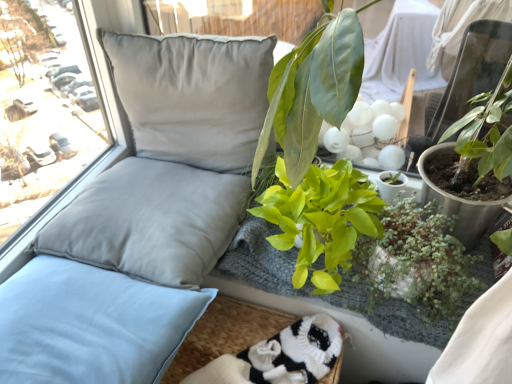
Describe the element at coordinates (90, 324) in the screenshot. I see `light blue fabric pillow at left, the third pillow in the top-to-bottom sequence` at that location.

This screenshot has width=512, height=384. What do you see at coordinates (193, 95) in the screenshot?
I see `satin gray pillow at upper left, which is the third pillow in bottom-to-top order` at bounding box center [193, 95].

I want to click on green leafy plant at center, which ranks as the second floral arrangement in top-to-bottom order, so click(366, 237).

What is the approximate height of green glossy plant at center, arranged as the second houseplant when viewed from the right?

The height of green glossy plant at center, arranged as the second houseplant when viewed from the right, is 25.40 centimeters.

Describe the element at coordinates (150, 221) in the screenshot. This screenshot has width=512, height=384. I see `satin gray pillow at left, which appears as the second pillow when viewed from the top` at that location.

What is the approximate width of white knitted socks at lower center?

The width of white knitted socks at lower center is 7.57 inches.

Where is `green matte plant at lower right, the first houseplant positioned from the right`? green matte plant at lower right, the first houseplant positioned from the right is located at coordinates (418, 260).

Is green glossy plant at center, which ranks as the 1th houseplant in left-to-right order, positioned behind green leafy plant at upper right, which is counted as the second floral arrangement, starting from the bottom?

Yes, green glossy plant at center, which ranks as the 1th houseplant in left-to-right order, is further from the camera.

From a real-world perspective, is green glossy plant at center, which ranks as the 1th houseplant in left-to-right order, positioned under green leafy plant at upper right, acting as the 1th floral arrangement starting from the top, based on gravity?

Yes, from a real-world perspective, green glossy plant at center, which ranks as the 1th houseplant in left-to-right order, is below green leafy plant at upper right, acting as the 1th floral arrangement starting from the top.

Is green glossy plant at center, which ranks as the 1th houseplant in left-to-right order, smaller than green leafy plant at upper right, acting as the 1th floral arrangement starting from the top?

Yes, green glossy plant at center, which ranks as the 1th houseplant in left-to-right order, is smaller than green leafy plant at upper right, acting as the 1th floral arrangement starting from the top.

Is green glossy plant at center, arranged as the second houseplant when viewed from the right, positioned far away from green leafy plant at upper right, which is counted as the second floral arrangement, starting from the bottom?

No.

Between green matte plant at lower right, the 2th houseplant in the left-to-right sequence, and green leafy plant at upper right, acting as the 1th floral arrangement starting from the top, which one appears on the right side from the viewer's perspective?

Positioned to the right is green matte plant at lower right, the 2th houseplant in the left-to-right sequence.

Locate an element on the screen. houseplant located on the right of green leafy plant at upper right, which is counted as the second floral arrangement, starting from the bottom is located at coordinates (418, 260).

From the image's perspective, which is below, green matte plant at lower right, the 2th houseplant in the left-to-right sequence, or green leafy plant at upper right, acting as the 1th floral arrangement starting from the top?

From the image's view, green matte plant at lower right, the 2th houseplant in the left-to-right sequence, is below.

Could you tell me if white knitted socks at lower center is facing light blue fabric pillow at left, placed as the first pillow when sorted from bottom to top?

No, white knitted socks at lower center does not turn towards light blue fabric pillow at left, placed as the first pillow when sorted from bottom to top.

Which object is closer to the camera taking this photo, white knitted socks at lower center or light blue fabric pillow at left, placed as the first pillow when sorted from bottom to top?

light blue fabric pillow at left, placed as the first pillow when sorted from bottom to top.

The height and width of the screenshot is (384, 512). In order to click on wide that appears behind the light blue fabric pillow at left, the third pillow in the top-to-bottom sequence in this screenshot , I will do `click(280, 356)`.

What's the angular difference between white knitted socks at lower center and light blue fabric pillow at left, the third pillow in the top-to-bottom sequence,'s facing directions?

The facing directions of white knitted socks at lower center and light blue fabric pillow at left, the third pillow in the top-to-bottom sequence, are 32.4 degrees apart.

In the scene shown: Are green leafy plant at upper right, acting as the 1th floral arrangement starting from the top, and green matte plant at lower right, the 2th houseplant in the left-to-right sequence, far apart?

No, green leafy plant at upper right, acting as the 1th floral arrangement starting from the top, is not far from green matte plant at lower right, the 2th houseplant in the left-to-right sequence.

From a real-world perspective, between green leafy plant at upper right, which is counted as the second floral arrangement, starting from the bottom, and green matte plant at lower right, the 2th houseplant in the left-to-right sequence, who is vertically higher?

green leafy plant at upper right, which is counted as the second floral arrangement, starting from the bottom, is physically above.

Is green leafy plant at upper right, which is counted as the second floral arrangement, starting from the bottom, facing away from green matte plant at lower right, the first houseplant positioned from the right?

No, green leafy plant at upper right, which is counted as the second floral arrangement, starting from the bottom, is not facing the opposite direction of green matte plant at lower right, the first houseplant positioned from the right.

Which is correct: green leafy plant at center, the first floral arrangement in the bottom-to-top sequence, is inside green leafy plant at upper right, acting as the 1th floral arrangement starting from the top, or outside of it?

green leafy plant at center, the first floral arrangement in the bottom-to-top sequence, is outside green leafy plant at upper right, acting as the 1th floral arrangement starting from the top.

From a real-world perspective, is green leafy plant at center, which ranks as the second floral arrangement in top-to-bottom order, beneath green leafy plant at upper right, which is counted as the second floral arrangement, starting from the bottom?

Correct, in the physical world, green leafy plant at center, which ranks as the second floral arrangement in top-to-bottom order, is lower than green leafy plant at upper right, which is counted as the second floral arrangement, starting from the bottom.

Find the location of a particular element. This screenshot has width=512, height=384. floral arrangement that is above the green leafy plant at center, the first floral arrangement in the bottom-to-top sequence (from the image's perspective) is located at coordinates (312, 91).

Measure the distance between satin gray pillow at left, which ranks as the second pillow in bottom-to-top order, and white knitted socks at lower center.

satin gray pillow at left, which ranks as the second pillow in bottom-to-top order, and white knitted socks at lower center are 13.12 inches apart.

From a real-world perspective, is satin gray pillow at left, which appears as the second pillow when viewed from the top, positioned above or below white knitted socks at lower center?

From a real-world perspective, satin gray pillow at left, which appears as the second pillow when viewed from the top, is physically above white knitted socks at lower center.

Locate an element on the screen. This screenshot has height=384, width=512. wide in front of the satin gray pillow at left, which appears as the second pillow when viewed from the top is located at coordinates (280, 356).

Does point (65, 254) come in front of point (303, 338)?

That is True.

Would you say white knitted socks at lower center is inside or outside green matte plant at lower right, the first houseplant positioned from the right?

white knitted socks at lower center exists outside the volume of green matte plant at lower right, the first houseplant positioned from the right.

Considering the sizes of objects white knitted socks at lower center and green matte plant at lower right, the first houseplant positioned from the right, in the image provided, who is bigger, white knitted socks at lower center or green matte plant at lower right, the first houseplant positioned from the right,?

green matte plant at lower right, the first houseplant positioned from the right, is bigger.

You are a GUI agent. You are given a task and a screenshot of the screen. Output one action in this format:
    pyautogui.click(x=<x>, y=<y>)
    Task: Click on the houseplant that is the 2nd object located in front of the white knitted socks at lower center
    
    Given the screenshot: What is the action you would take?
    pyautogui.click(x=418, y=260)

Find the location of a particular element. This screenshot has width=512, height=384. floral arrangement located above the green glossy plant at center, which ranks as the 1th houseplant in left-to-right order (from a real-world perspective) is located at coordinates (312, 91).

From the green matte plant at lower right, the 2th houseplant in the left-to-right sequence, count the 1st floral arrangement to the left and point to it. Please provide its 2D coordinates.

[(312, 91)]

Which object lies further to the anchor point white knitted socks at lower center, green leafy plant at upper right, acting as the 1th floral arrangement starting from the top, or light blue fabric pillow at left, placed as the first pillow when sorted from bottom to top?

Based on the image, green leafy plant at upper right, acting as the 1th floral arrangement starting from the top, appears to be further to white knitted socks at lower center.

Based on their spatial positions, is satin gray pillow at left, which appears as the second pillow when viewed from the top, or green leafy plant at upper right, acting as the 1th floral arrangement starting from the top, further from satin gray pillow at upper left, which is the third pillow in bottom-to-top order?

Based on the image, green leafy plant at upper right, acting as the 1th floral arrangement starting from the top, appears to be further to satin gray pillow at upper left, which is the third pillow in bottom-to-top order.

Looking at the image, which one is located further to light blue fabric pillow at left, placed as the first pillow when sorted from bottom to top, green leafy plant at center, which ranks as the second floral arrangement in top-to-bottom order, or green leafy plant at upper right, which is counted as the second floral arrangement, starting from the bottom?

green leafy plant at upper right, which is counted as the second floral arrangement, starting from the bottom.

Considering their positions, is green leafy plant at upper right, acting as the 1th floral arrangement starting from the top, positioned further to green leafy plant at center, the first floral arrangement in the bottom-to-top sequence, than green matte plant at lower right, the first houseplant positioned from the right?

green leafy plant at upper right, acting as the 1th floral arrangement starting from the top, is further to green leafy plant at center, the first floral arrangement in the bottom-to-top sequence.

Looking at the image, which one is located further to satin gray pillow at left, which ranks as the second pillow in bottom-to-top order, satin gray pillow at upper left, acting as the 1th pillow starting from the top, or green leafy plant at upper right, which is counted as the second floral arrangement, starting from the bottom?

The object further to satin gray pillow at left, which ranks as the second pillow in bottom-to-top order, is green leafy plant at upper right, which is counted as the second floral arrangement, starting from the bottom.

From the image, which object appears to be nearer to satin gray pillow at left, which ranks as the second pillow in bottom-to-top order, green matte plant at lower right, the 2th houseplant in the left-to-right sequence, or green leafy plant at upper right, which is counted as the second floral arrangement, starting from the bottom?

Among the two, green leafy plant at upper right, which is counted as the second floral arrangement, starting from the bottom, is located nearer to satin gray pillow at left, which ranks as the second pillow in bottom-to-top order.

When comparing their distances from satin gray pillow at left, which ranks as the second pillow in bottom-to-top order, does green leafy plant at center, which ranks as the second floral arrangement in top-to-bottom order, or green glossy plant at center, which ranks as the 1th houseplant in left-to-right order, seem closer?

Based on the image, green glossy plant at center, which ranks as the 1th houseplant in left-to-right order, appears to be nearer to satin gray pillow at left, which ranks as the second pillow in bottom-to-top order.

Based on their spatial positions, is satin gray pillow at upper left, which is the third pillow in bottom-to-top order, or satin gray pillow at left, which appears as the second pillow when viewed from the top, further from white knitted socks at lower center?

satin gray pillow at upper left, which is the third pillow in bottom-to-top order, is positioned further to the anchor white knitted socks at lower center.

The height and width of the screenshot is (384, 512). I want to click on houseplant between light blue fabric pillow at left, placed as the first pillow when sorted from bottom to top, and green matte plant at lower right, the first houseplant positioned from the right, so click(x=321, y=218).

This screenshot has width=512, height=384. I want to click on houseplant situated between satin gray pillow at left, which appears as the second pillow when viewed from the top, and green leafy plant at center, which ranks as the second floral arrangement in top-to-bottom order, from left to right, so click(321, 218).

This screenshot has height=384, width=512. I want to click on pillow located between satin gray pillow at left, which appears as the second pillow when viewed from the top, and green leafy plant at center, the first floral arrangement in the bottom-to-top sequence, in the left-right direction, so click(193, 95).

You are a GUI agent. You are given a task and a screenshot of the screen. Output one action in this format:
    pyautogui.click(x=<x>, y=<y>)
    Task: Click on the floral arrangement that lies between green glossy plant at center, which ranks as the 1th houseplant in left-to-right order, and white knitted socks at lower center from top to bottom
    The image size is (512, 384).
    Given the screenshot: What is the action you would take?
    (x=366, y=237)